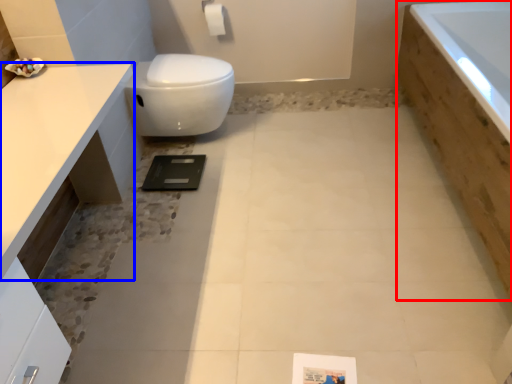
Question: Which object is closer to the camera taking this photo, bath (highlighted by a red box) or countertop (highlighted by a blue box)?

Choices:
 (A) bath
 (B) countertop

Answer: (B)